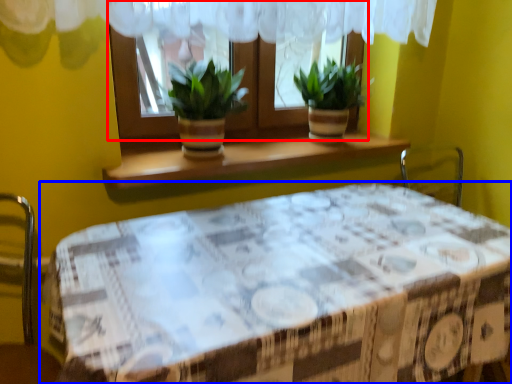
Question: Which point is closer to the camera, window (highlighted by a red box) or table (highlighted by a blue box)?

Choices:
 (A) window
 (B) table

Answer: (B)